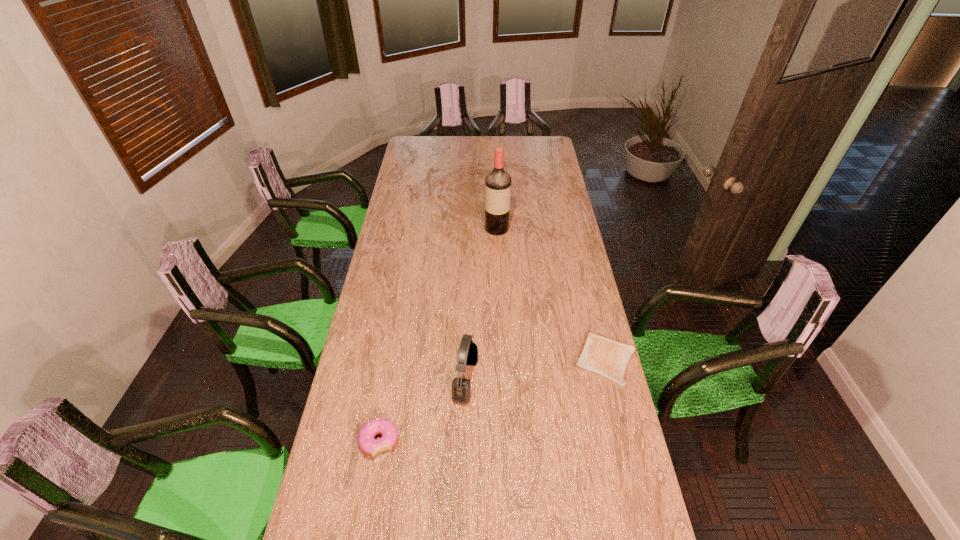
At what (x,y) coordinates should I click in order to perform the action: click on free space located on the front-facing side of the tallest object. Please return your answer as a coordinate pair (x, y). This screenshot has height=540, width=960. Looking at the image, I should click on (497, 263).

This screenshot has width=960, height=540. What are the coordinates of `free space located 0.190m on the front-facing side of the tallest object` in the screenshot? It's located at (497, 263).

Find the location of a particular element. vacant point located on the front-facing side of the tallest object is located at coordinates (497, 297).

Where is `vacant space located 0.170m on the headband of the third object from right to left`? Image resolution: width=960 pixels, height=540 pixels. vacant space located 0.170m on the headband of the third object from right to left is located at coordinates (527, 390).

You are a GUI agent. You are given a task and a screenshot of the screen. Output one action in this format:
    pyautogui.click(x=<x>, y=<y>)
    Task: Click on the free region located on the headband of the third object from right to left
    This screenshot has height=540, width=960.
    Given the screenshot: What is the action you would take?
    coord(595,400)

I want to click on vacant point located on the headband of the third object from right to left, so click(524, 390).

The width and height of the screenshot is (960, 540). Identify the location of object that is at the left edge. (367, 443).

Locate an element on the screen. This screenshot has width=960, height=540. object located at the right edge is located at coordinates (600, 356).

The width and height of the screenshot is (960, 540). In the image, there is a desktop. Find the location of `vacant space at the far edge`. vacant space at the far edge is located at coordinates (523, 139).

This screenshot has width=960, height=540. What are the coordinates of `vacant space at the near edge` in the screenshot? It's located at (546, 493).